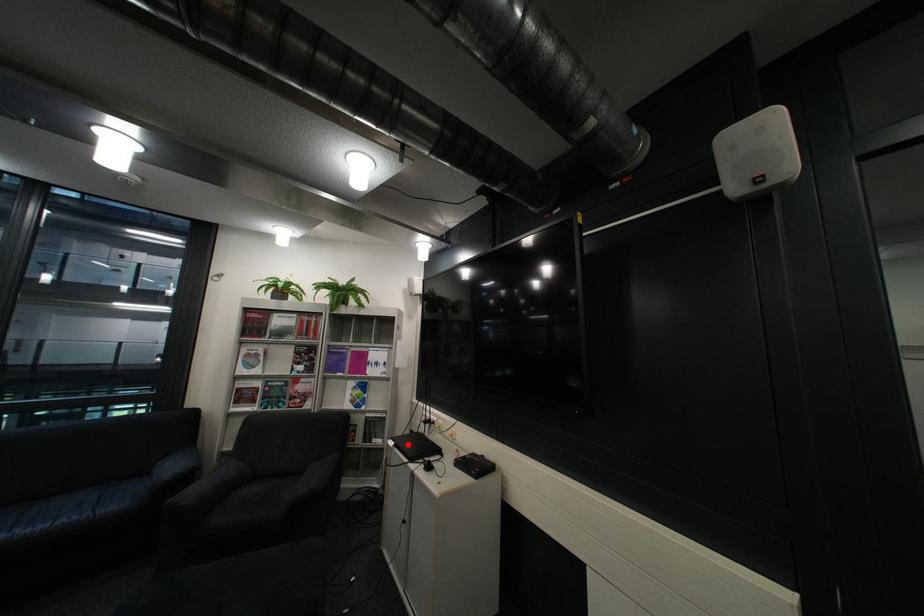
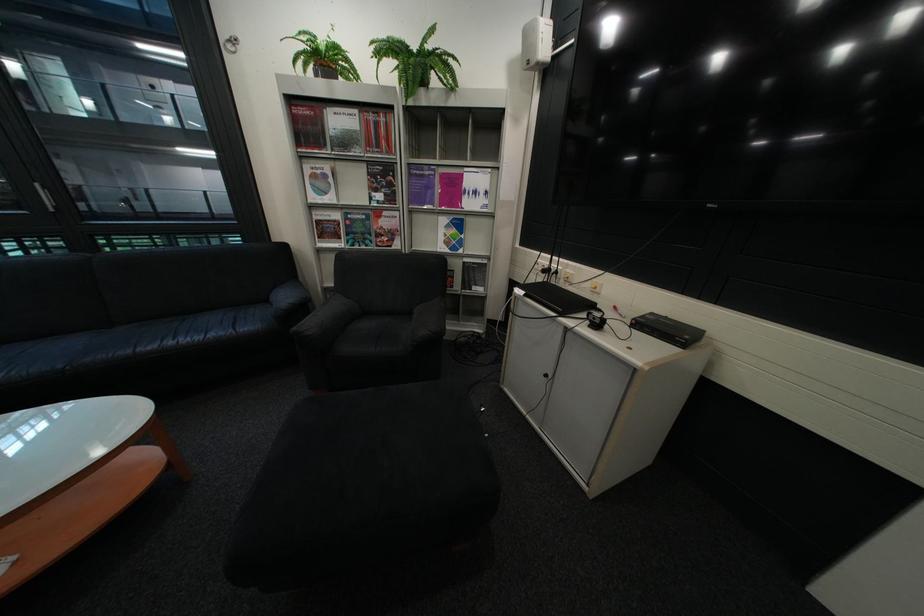
Where in the second image is the point corresponding to the highlighted location from the first image?

(538, 293)